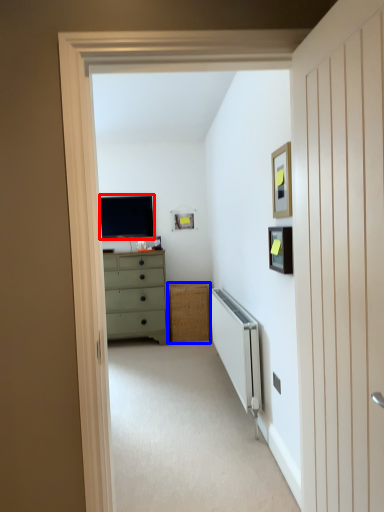
Question: Which object is closer to the camera taking this photo, television (highlighted by a red box) or cabinetry (highlighted by a blue box)?

Choices:
 (A) television
 (B) cabinetry

Answer: (B)